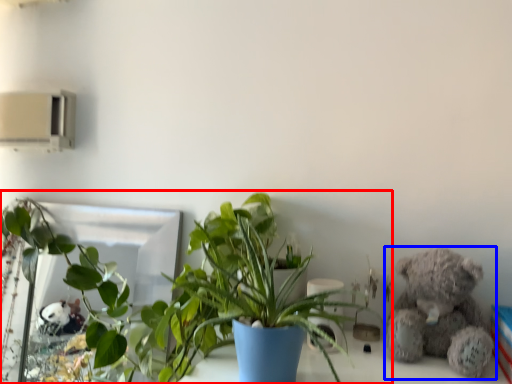
Question: Which object is further to the camera taking this photo, houseplant (highlighted by a red box) or teddy bear (highlighted by a blue box)?

Choices:
 (A) houseplant
 (B) teddy bear

Answer: (B)